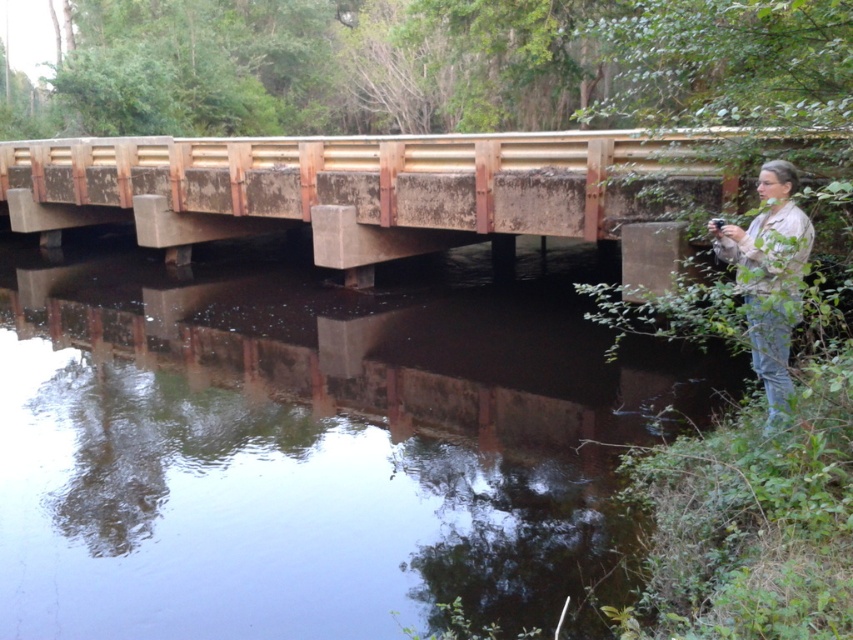
You are a hiker carrying a tan fabric jacket at right. You want to cross the rusty concrete bridge at center. Can you walk across the bridge while holding the jacket in one hand?

The rusty concrete bridge at center is wider than the tan fabric jacket at right, so yes, you can walk across the bridge while holding the jacket in one hand since the bridge is wide enough to accommodate your movement.